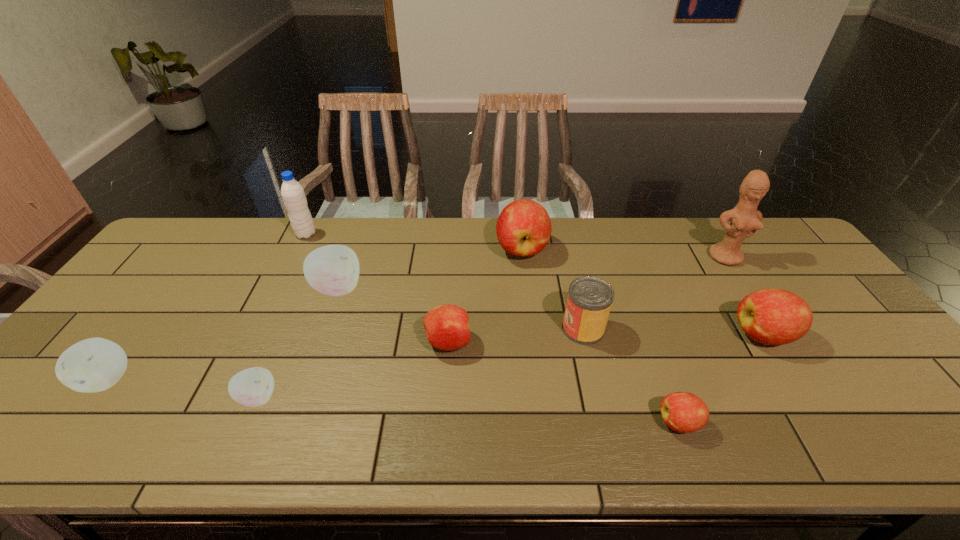
The width and height of the screenshot is (960, 540). Find the location of `the tallest object`. the tallest object is located at coordinates (745, 219).

You are a GUI agent. You are given a task and a screenshot of the screen. Output one action in this format:
    pyautogui.click(x=<x>, y=<y>)
    Task: Click on the gray water bottle
    The image size is (960, 540).
    Given the screenshot: What is the action you would take?
    pyautogui.click(x=293, y=195)

Identify the location of water bottle. This screenshot has width=960, height=540. (293, 195).

Find the location of `the fifth apple from left to right`. the fifth apple from left to right is located at coordinates (523, 228).

Image resolution: width=960 pixels, height=540 pixels. What are the coordinates of `the second red apple from left to right` in the screenshot? It's located at (523, 228).

In order to click on the farthest white apple in this screenshot , I will do `click(333, 270)`.

Where is `the biggest white apple`? This screenshot has width=960, height=540. the biggest white apple is located at coordinates (333, 270).

Identify the location of the rightmost apple. The width and height of the screenshot is (960, 540). tap(770, 316).

The height and width of the screenshot is (540, 960). Identify the location of the rightmost red apple. (770, 316).

Identify the location of can. (589, 301).